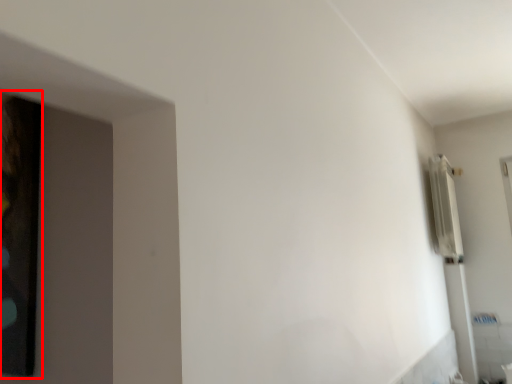
Question: From the image's perspective, what is the correct spatial positioning of picture frame (annotated by the red box) in reference to radiator?

Choices:
 (A) above
 (B) below

Answer: (A)